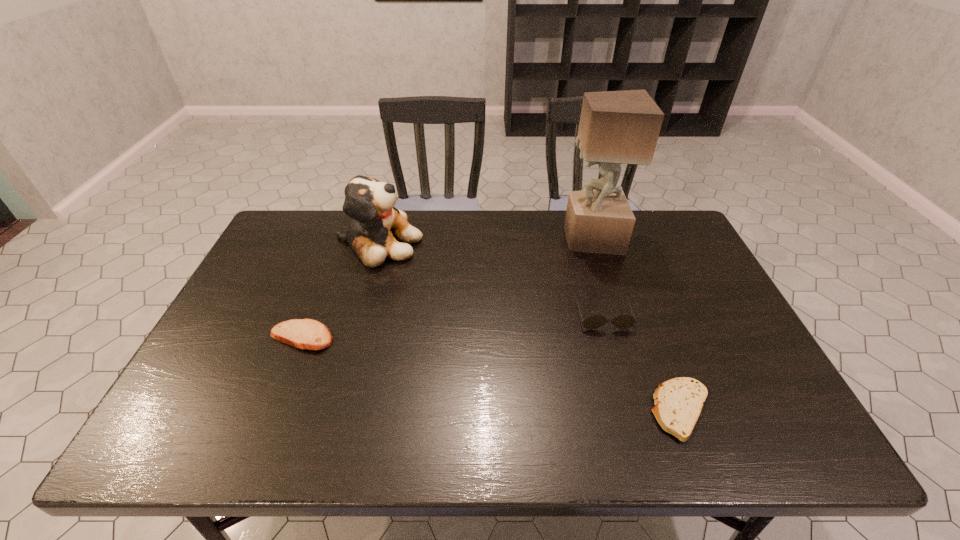
At what (x,y) coordinates should I click in order to perform the action: click on unoccupied area between the left pita bread and the shorter pita bread. Please return your answer as a coordinate pair (x, y). The image size is (960, 540). Looking at the image, I should click on (492, 374).

Locate an element on the screen. This screenshot has height=540, width=960. free space between the fourth shortest object and the left pita bread is located at coordinates (340, 290).

Point out which object is positioned as the third nearest to the puppy. Please provide its 2D coordinates. Your answer should be formatted as a tuple, i.e. [(x, y)], where the tuple contains the x and y coordinates of a point satisfying the conditions above.

[(623, 321)]

Select which object appears as the closest to the nearest object. Please provide its 2D coordinates. Your answer should be formatted as a tuple, i.e. [(x, y)], where the tuple contains the x and y coordinates of a point satisfying the conditions above.

[(623, 321)]

Locate an element on the screen. Image resolution: width=960 pixels, height=540 pixels. free location that satisfies the following two spatial constraints: 1. at the face of the puppy; 2. on the back side of the shorter pita bread is located at coordinates (331, 410).

Locate an element on the screen. This screenshot has width=960, height=540. free space in the image that satisfies the following two spatial constraints: 1. on the front-facing side of the shortest object; 2. on the right side of the sculpture is located at coordinates (645, 410).

Image resolution: width=960 pixels, height=540 pixels. What are the coordinates of `free spot that satisfies the following two spatial constraints: 1. at the face of the puppy; 2. on the front side of the left pita bread` in the screenshot? It's located at (352, 337).

Where is `free location that satisfies the following two spatial constraints: 1. on the back side of the nearer pita bread; 2. at the face of the puppy`? The height and width of the screenshot is (540, 960). free location that satisfies the following two spatial constraints: 1. on the back side of the nearer pita bread; 2. at the face of the puppy is located at coordinates (618, 243).

Locate an element on the screen. The image size is (960, 540). free region that satisfies the following two spatial constraints: 1. on the front-facing side of the nearer pita bread; 2. on the right side of the third tallest object is located at coordinates (630, 410).

Where is `free point that satisfies the following two spatial constraints: 1. on the front-facing side of the tallest object; 2. on the right side of the shorter pita bread`? The height and width of the screenshot is (540, 960). free point that satisfies the following two spatial constraints: 1. on the front-facing side of the tallest object; 2. on the right side of the shorter pita bread is located at coordinates (645, 410).